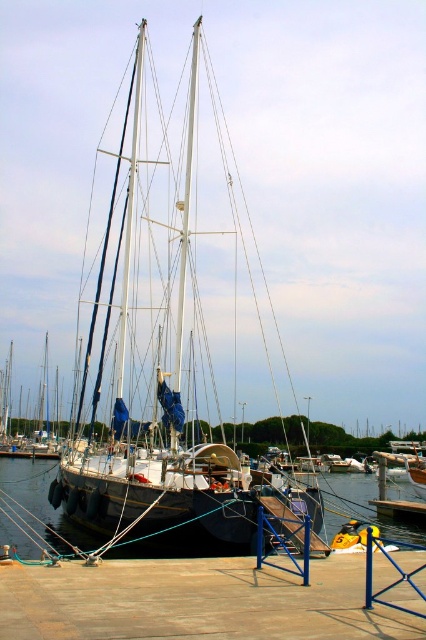
You are standing on the brown wooden dock at lower center and want to board the black rubber boat at center. Which direction should you move to reach the boat?

Since the brown wooden dock at lower center is in front of the black rubber boat at center, you should move backward to reach the boat.

You are a maintenance worker needing to inspect the white matte sailboat at center. You are currently standing on the brown wooden dock at lower center. Can you walk directly to the sailboat without needing to use a ladder or boat ramp?

The distance between the brown wooden dock at lower center and the white matte sailboat at center is 4.55 meters. Since this distance is quite large, you would need to use a ladder or boat ramp to reach the sailboat from the dock.

From the picture: You are planning to transport both the white matte sailboat at center and the black rubber boat at center onto a trailer. The trailer can only accommodate one boat at a time. Based on their sizes, which boat would require a larger trailer? Please explain your reasoning.

The black rubber boat at center requires a larger trailer because it is bigger than the white matte sailboat at center according to the description.